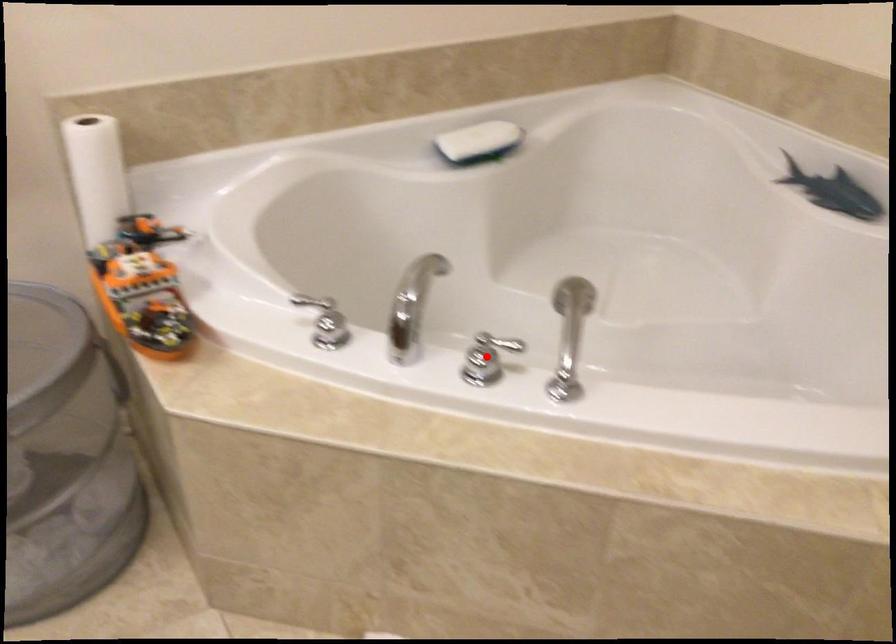
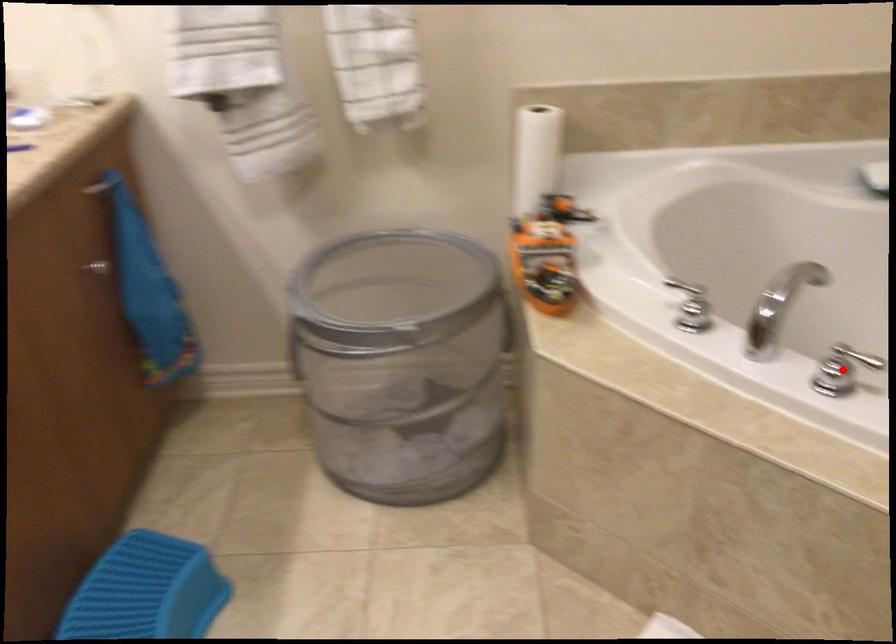
I am providing you with two images of the same scene from different viewpoints. A red point is marked on the first image and another point is marked on the second image. Are the points marked in image1 and image2 representing the same 3D position?

Yes